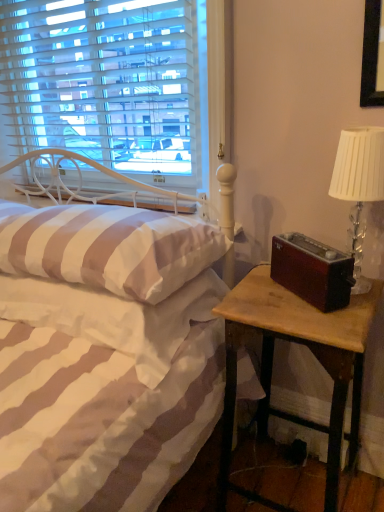
Question: From a real-world perspective, is white striped pillow at center above or below white striped fabric at lower left?

Choices:
 (A) below
 (B) above

Answer: (B)

Question: Is point (34, 252) positioned closer to the camera than point (99, 326)?

Choices:
 (A) farther
 (B) closer

Answer: (A)

Question: Estimate the real-world distances between objects in this image. Which object is closer to the white striped fabric at lower left?

Choices:
 (A) white striped pillow at center
 (B) clear glass table lamp at right
 (C) wooden nightstand at right
 (D) white striped bed at center

Answer: (D)

Question: Based on their relative distances, which object is nearer to the wooden nightstand at right?

Choices:
 (A) white striped fabric at lower left
 (B) white striped pillow at center
 (C) white striped bed at center
 (D) clear glass table lamp at right

Answer: (C)